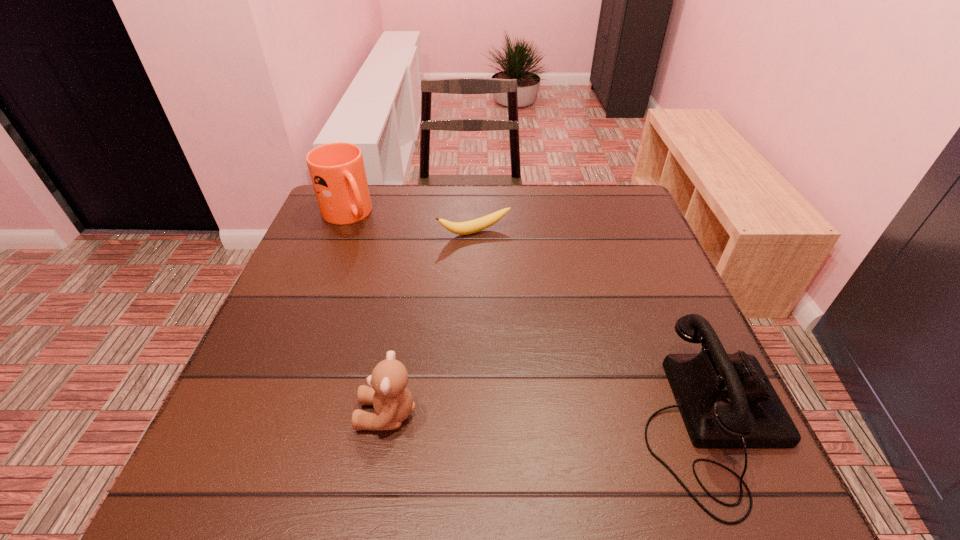
Where is `free space that satisfies the following two spatial constraints: 1. on the front side of the rightmost object; 2. on the front face of the tallest object`? free space that satisfies the following two spatial constraints: 1. on the front side of the rightmost object; 2. on the front face of the tallest object is located at coordinates (265, 422).

Find the location of a particular element. vacant space that satisfies the following two spatial constraints: 1. on the front side of the mug; 2. on the front face of the rightmost object is located at coordinates (265, 422).

Identify the location of vacant space that satisfies the following two spatial constraints: 1. on the front side of the telephone; 2. on the front face of the leftmost object. Image resolution: width=960 pixels, height=540 pixels. (265, 422).